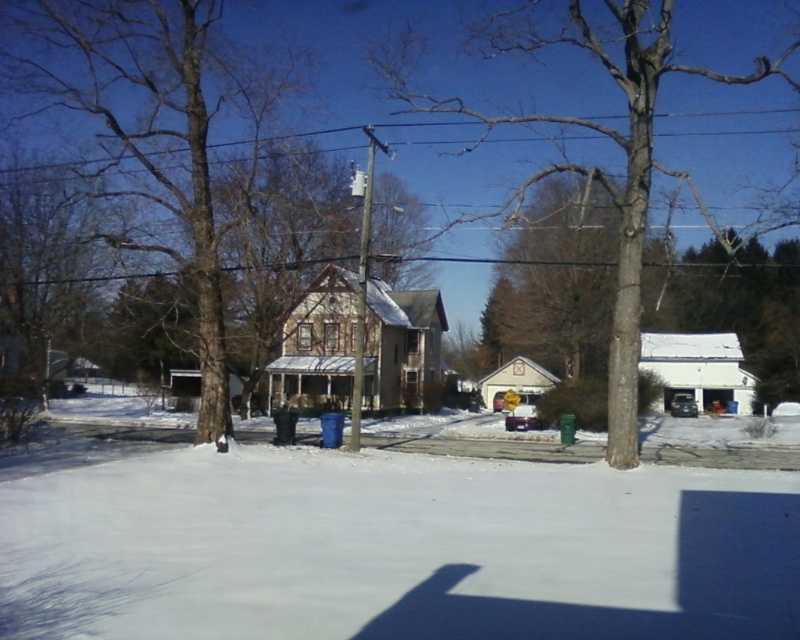
Is brown rough tree at center positioned in front of white plastic utility pole at center?

That is True.

From the picture: Does brown rough tree at center appear under white plastic utility pole at center?

Incorrect, brown rough tree at center is not positioned below white plastic utility pole at center.

Between point (36, 65) and point (360, 324), which one is positioned in front?

Positioned in front is point (36, 65).

Where is `brown rough tree at center`? Image resolution: width=800 pixels, height=640 pixels. brown rough tree at center is located at coordinates (146, 129).

Does point (120, 38) come in front of point (676, 115)?

Yes, it is in front of point (676, 115).

Is point (110, 109) behind point (388, 125)?

No, it is not.

The width and height of the screenshot is (800, 640). Describe the element at coordinates (146, 129) in the screenshot. I see `brown rough tree at center` at that location.

The height and width of the screenshot is (640, 800). I want to click on brown rough tree at center, so click(146, 129).

Is brown rough tree at center bigger than brown textured tree at center?

Incorrect, brown rough tree at center is not larger than brown textured tree at center.

Is brown rough tree at center above brown textured tree at center?

Incorrect, brown rough tree at center is not positioned above brown textured tree at center.

Locate an element on the screen. The image size is (800, 640). brown rough tree at center is located at coordinates (146, 129).